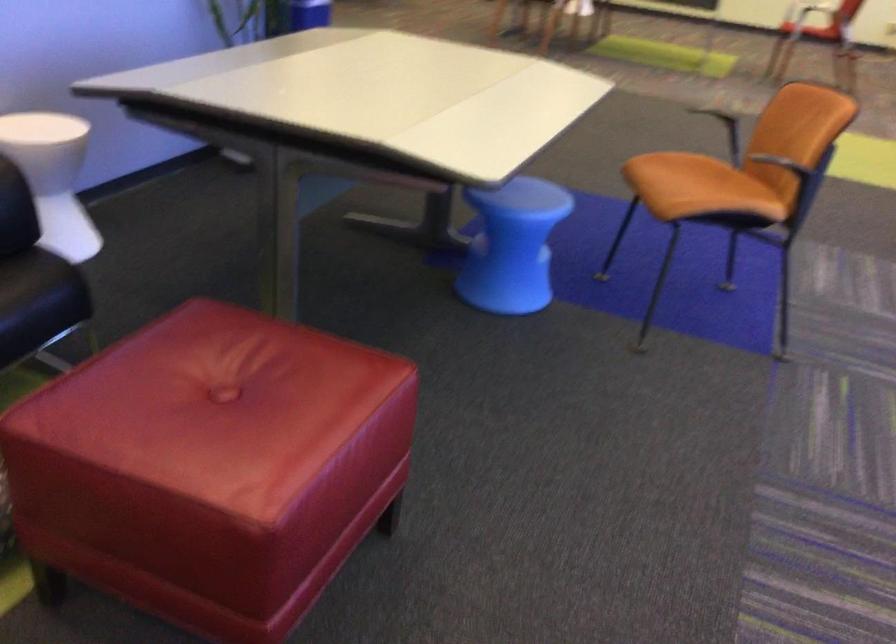
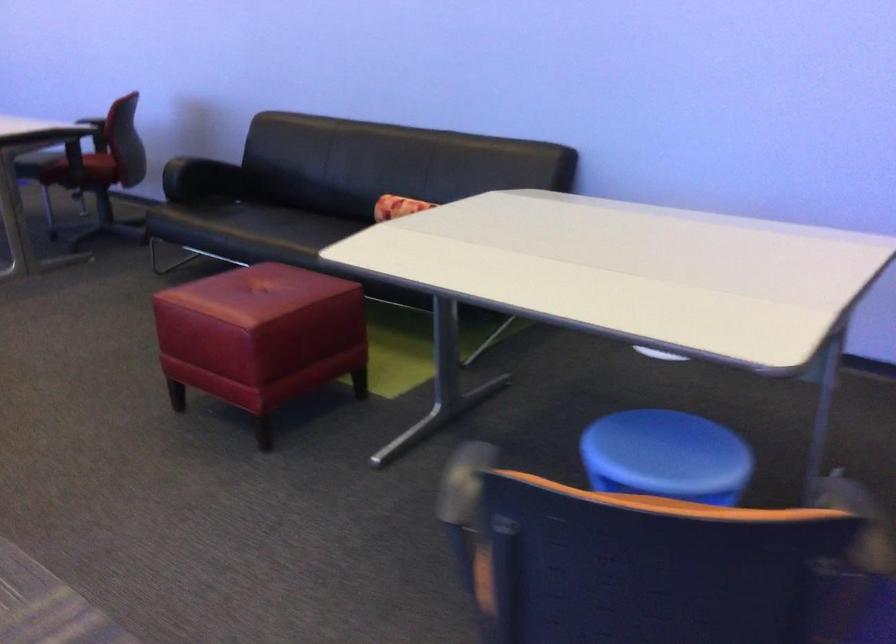
Locate, in the second image, the point that corresponds to point 225,393 in the first image.

(260, 292)